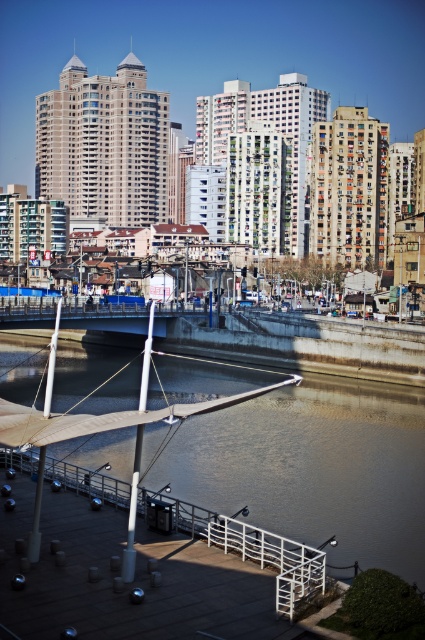
You are a delivery drone with a maximum flight range of 70 feet. You need to deliver a package from the white wooden dock at lower center to the brown concrete river at center. Can you complete the delivery without needing to recharge?

The distance between the white wooden dock at lower center and the brown concrete river at center is 75.24 feet, which exceeds the drone

You are standing at the camera position and want to cross the brown concrete river at center. The bridge is 100 feet long. Can you reach the other side without getting wet?

The brown concrete river at center and camera are 99.90 feet apart. The bridge is 100 feet long, so yes, you can reach the other side without getting wet because the bridge is slightly longer than the distance to the river.

You are planning to cross the river using the white wooden dock at lower center. Considering the width of the brown concrete river at center, do you think the dock is long enough to reach the other side?

The brown concrete river at center is wider than the white wooden dock at lower center, so the dock may not be long enough to reach the other side.